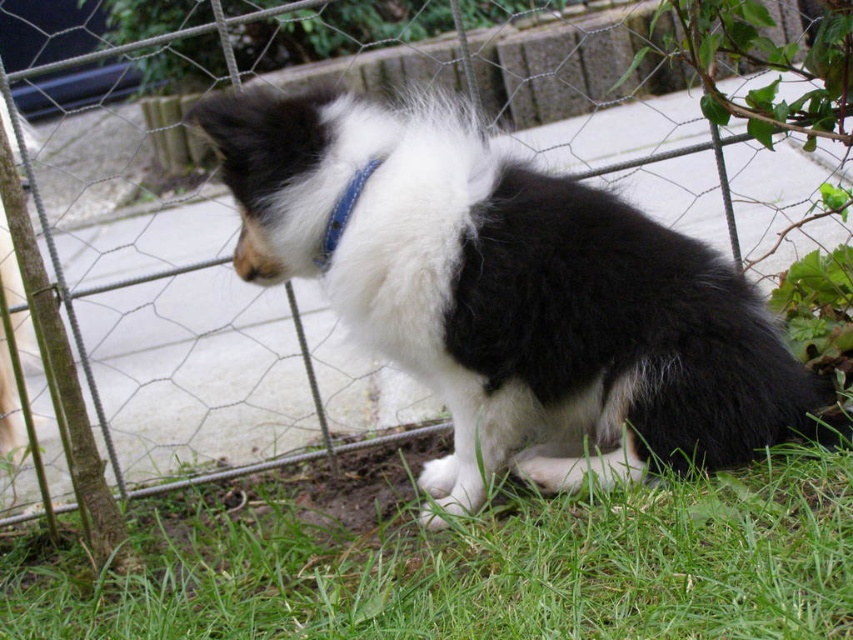
From the picture: You are standing in the garden where the puppy is. You see two points marked in the image. The first point is at coordinate point(399, 208) and the second point is at coordinate point(776, 492). If you want to throw a ball to the point closer to you, which point should you aim for?

You should aim for point(776, 492) because it is closer to you than point(399, 208).

You are standing in the garden where the puppy is located. You notice a specific point marked at coordinates [509,294]. What can you find at that exact point?

At point [509,294], you can find black and white fur at center.